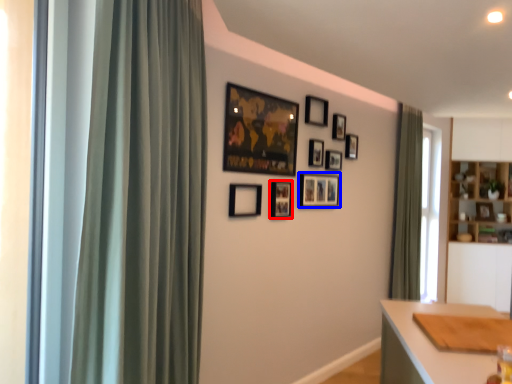
Question: Which object appears closest to the camera in this image, picture frame (highlighted by a red box) or picture frame (highlighted by a blue box)?

Choices:
 (A) picture frame
 (B) picture frame

Answer: (A)